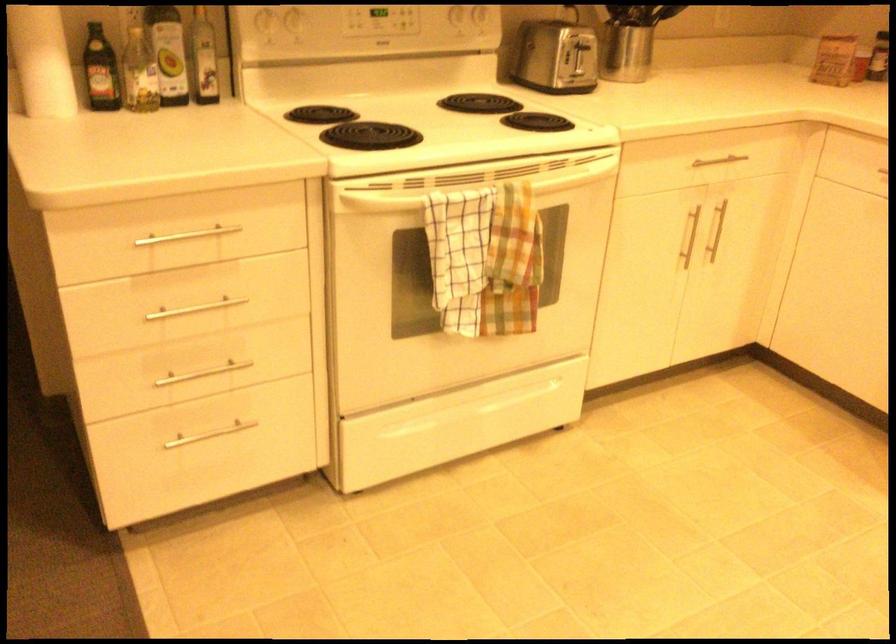
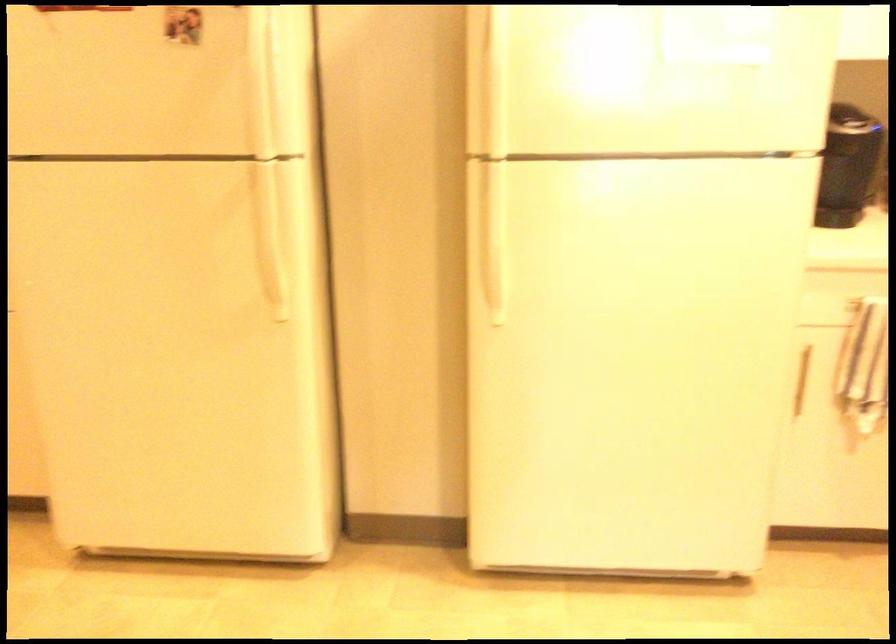
Question: How did the camera likely rotate?

Choices:
 (A) Left
 (B) Right
 (C) Up
 (D) Down

Answer: (B)